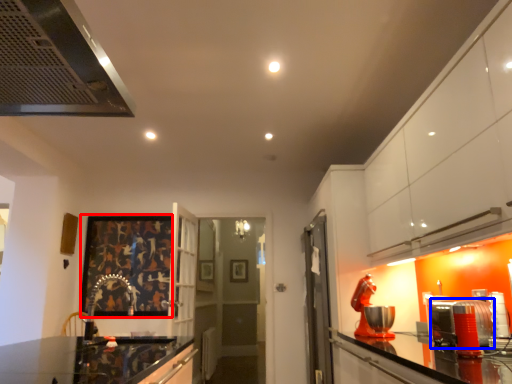
Question: Among these objects, which one is farthest to the camera, picture frame (highlighted by a red box) or appliance (highlighted by a blue box)?

Choices:
 (A) picture frame
 (B) appliance

Answer: (A)